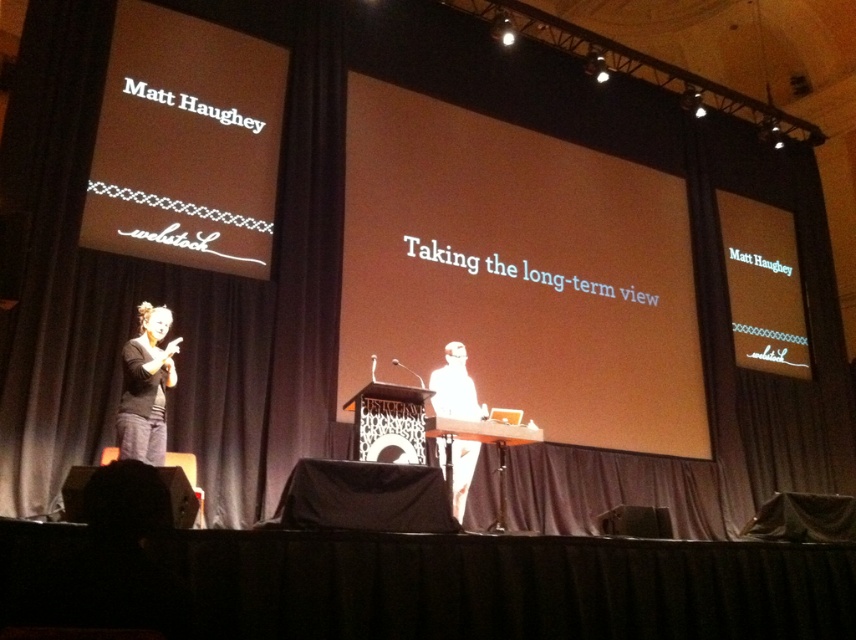
The image size is (856, 640). I want to click on black soft fabric at left, so point(146,387).

Can you confirm if black soft fabric at left is positioned to the right of white paper at center?

In fact, black soft fabric at left is to the left of white paper at center.

Where is `black soft fabric at left`? black soft fabric at left is located at coordinates (146, 387).

How distant is dark gray curtain at left from white paper at center?

dark gray curtain at left and white paper at center are 1.57 meters apart from each other.

Consider the image. Is dark gray curtain at left closer to the viewer compared to white paper at center?

No, dark gray curtain at left is behind white paper at center.

Is point (284, 323) closer to viewer compared to point (447, 385)?

No, it is behind (447, 385).

The height and width of the screenshot is (640, 856). I want to click on dark gray curtain at left, so click(x=177, y=282).

Who is lower down, dark gray curtain at left or black soft fabric at left?

dark gray curtain at left is below.

Is point (242, 390) closer to viewer compared to point (159, 326)?

No, it is not.

Is point (108, 412) positioned after point (132, 436)?

Yes, it is behind point (132, 436).

The height and width of the screenshot is (640, 856). In order to click on dark gray curtain at left in this screenshot , I will do `click(177, 282)`.